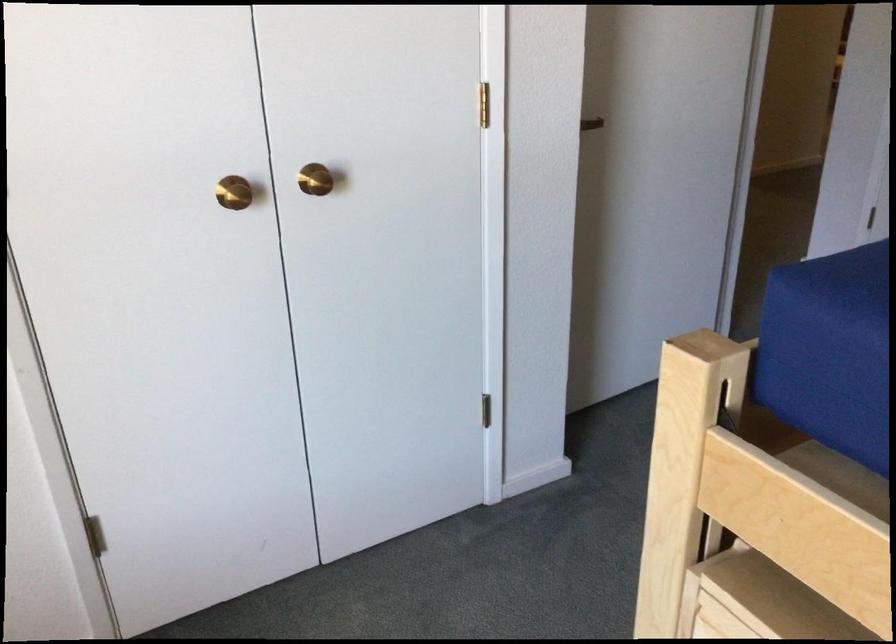
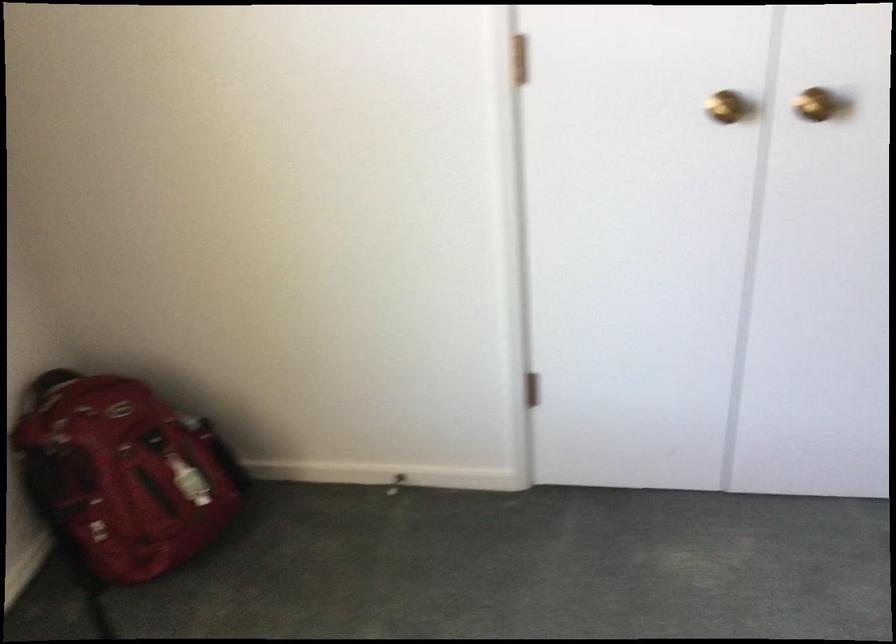
Locate, in the second image, the point that corresponds to the point at 316,185 in the first image.

(814, 104)